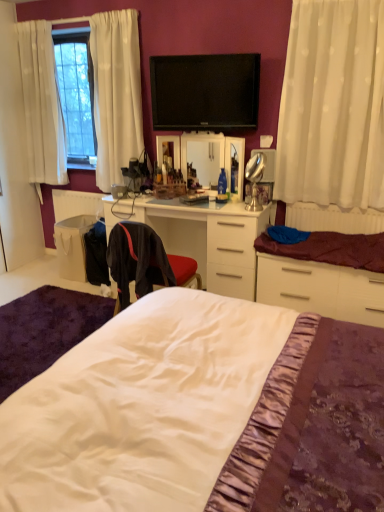
Question: Is white satin bed at center wider than flat screen tv at upper center?

Choices:
 (A) yes
 (B) no

Answer: (A)

Question: Is white satin bed at center outside flat screen tv at upper center?

Choices:
 (A) yes
 (B) no

Answer: (A)

Question: Does white satin bed at center have a lesser height compared to flat screen tv at upper center?

Choices:
 (A) yes
 (B) no

Answer: (B)

Question: Is white satin bed at center looking in the opposite direction of flat screen tv at upper center?

Choices:
 (A) no
 (B) yes

Answer: (A)

Question: Does white satin bed at center have a smaller size compared to flat screen tv at upper center?

Choices:
 (A) yes
 (B) no

Answer: (B)

Question: Does white satin bed at center contain flat screen tv at upper center?

Choices:
 (A) no
 (B) yes

Answer: (A)

Question: Can you confirm if white fabric bag at lower left is smaller than flat screen tv at upper center?

Choices:
 (A) no
 (B) yes

Answer: (A)

Question: Is white fabric bag at lower left positioned beyond the bounds of flat screen tv at upper center?

Choices:
 (A) yes
 (B) no

Answer: (A)

Question: Is white fabric bag at lower left positioned with its back to flat screen tv at upper center?

Choices:
 (A) yes
 (B) no

Answer: (B)

Question: Does white fabric bag at lower left have a lesser height compared to flat screen tv at upper center?

Choices:
 (A) no
 (B) yes

Answer: (B)

Question: Is white fabric bag at lower left taller than flat screen tv at upper center?

Choices:
 (A) yes
 (B) no

Answer: (B)

Question: Is white fabric bag at lower left positioned before flat screen tv at upper center?

Choices:
 (A) no
 (B) yes

Answer: (A)

Question: Is black fabric chair at center at the right side of white plastic radiator at right?

Choices:
 (A) no
 (B) yes

Answer: (A)